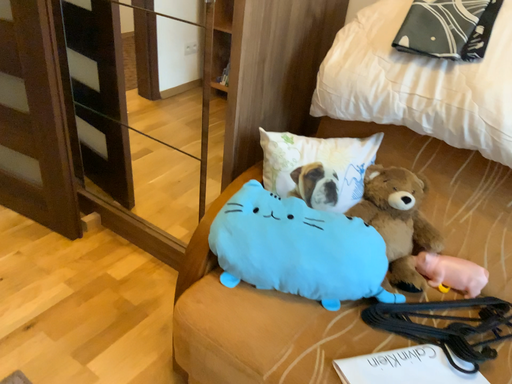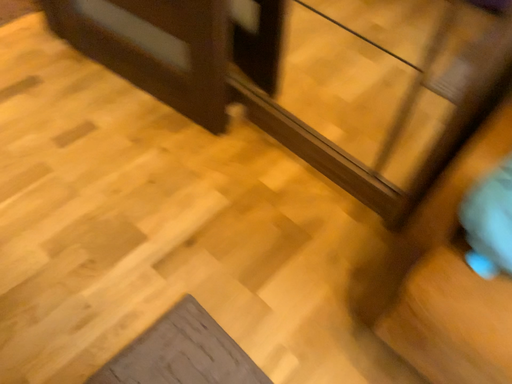
Question: How did the camera likely rotate when shooting the video?

Choices:
 (A) rotated downward
 (B) rotated upward

Answer: (A)